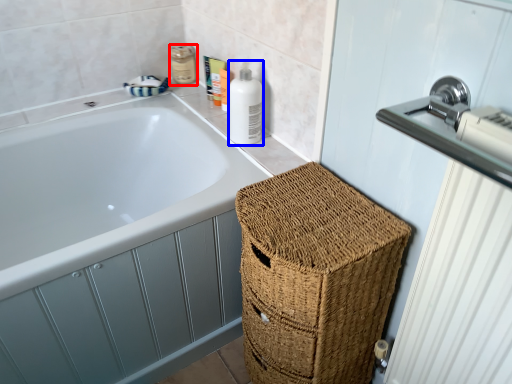
Question: Which object appears closest to the camera in this image, toiletry (highlighted by a red box) or cleaning product (highlighted by a blue box)?

Choices:
 (A) toiletry
 (B) cleaning product

Answer: (B)